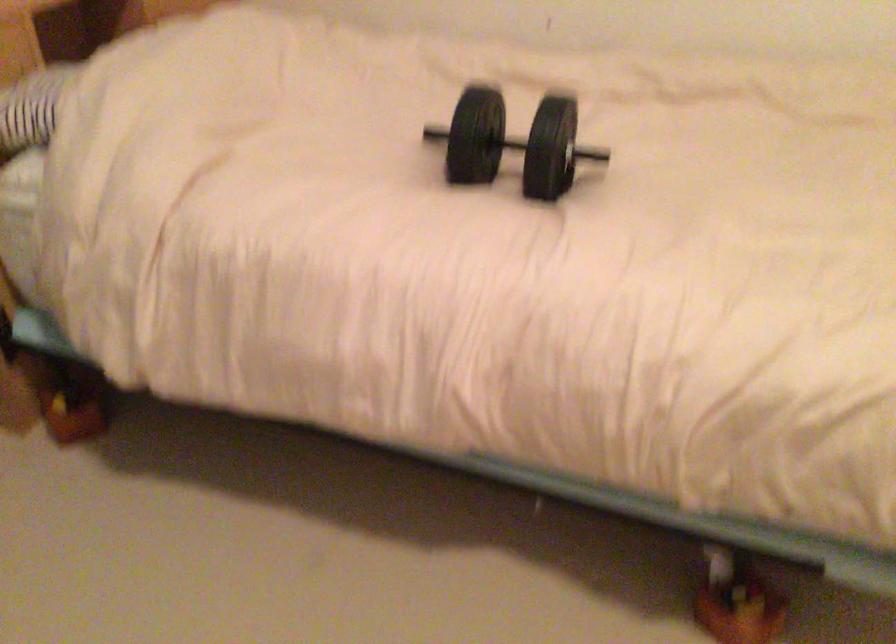
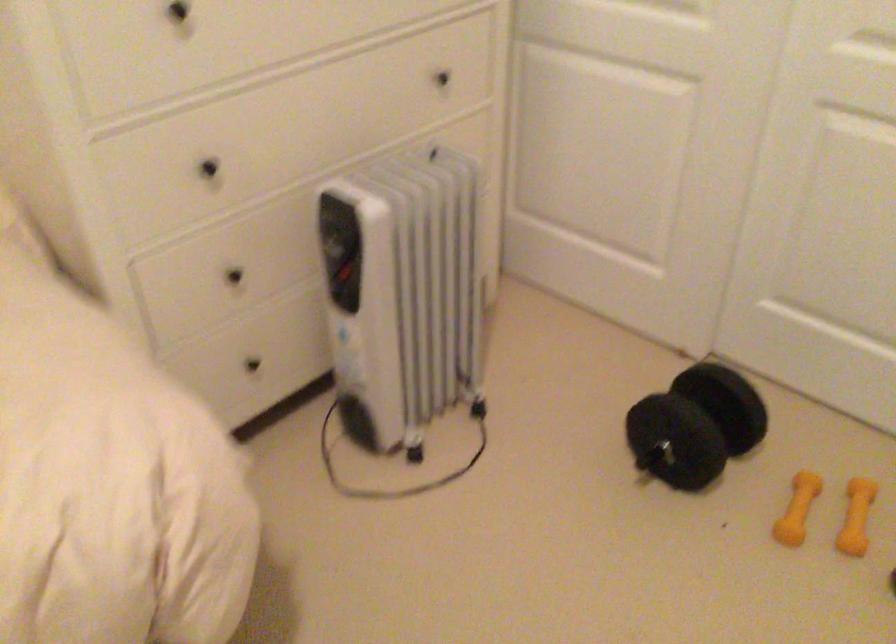
Based on the continuous images, in which direction is the camera rotating?

The camera's rotation is toward right-down.